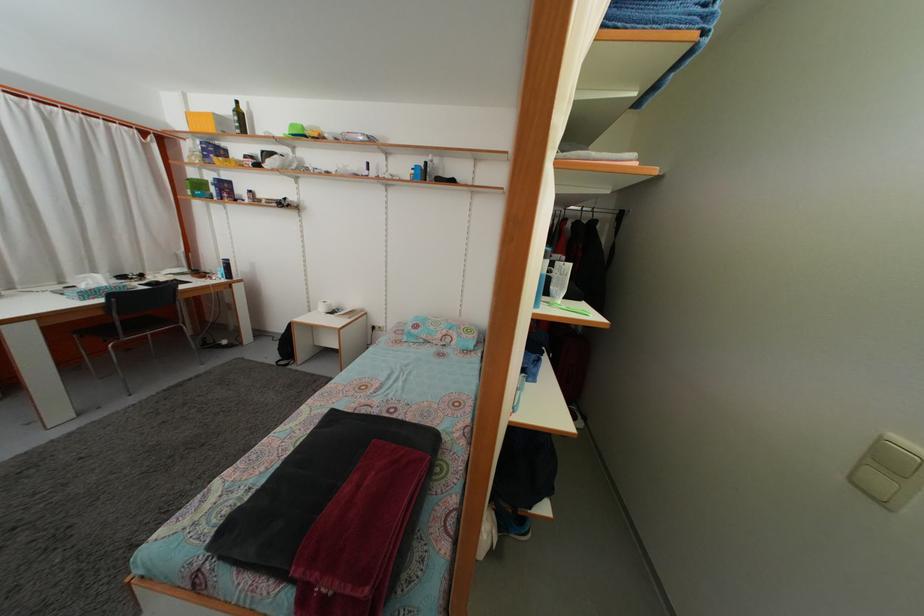
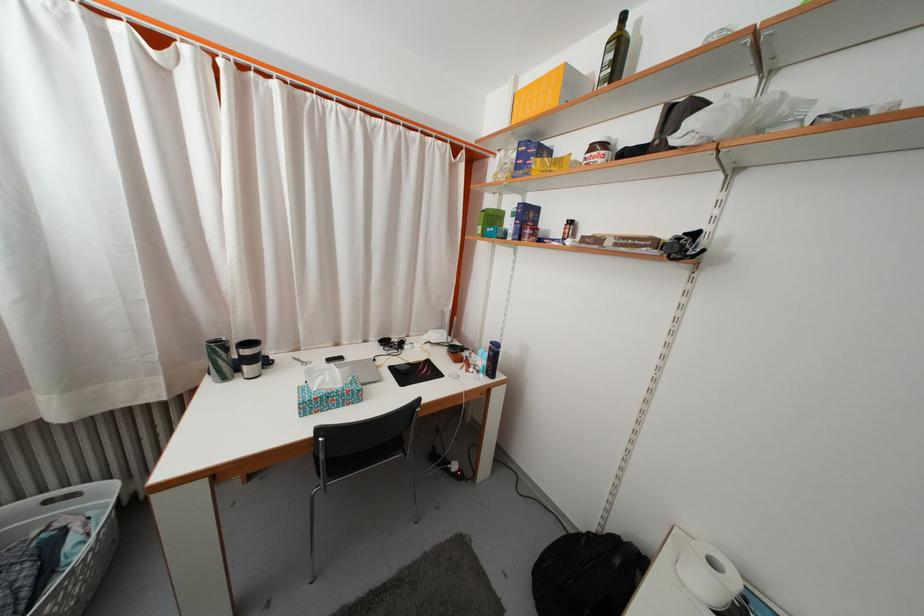
Where in the second image is the point corresponding to pixel 246 122 from the first image?

(625, 54)